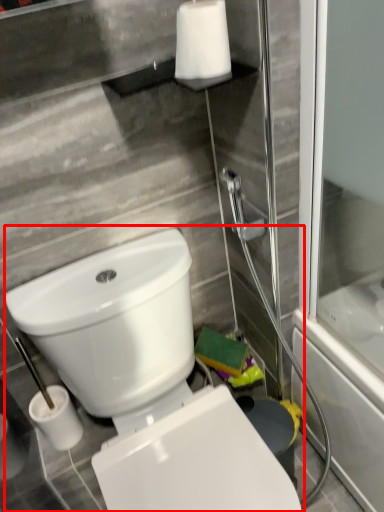
Question: From the image's perspective, what is the correct spatial relationship of toilet (annotated by the red box) in relation to toilet paper?

Choices:
 (A) below
 (B) above

Answer: (A)